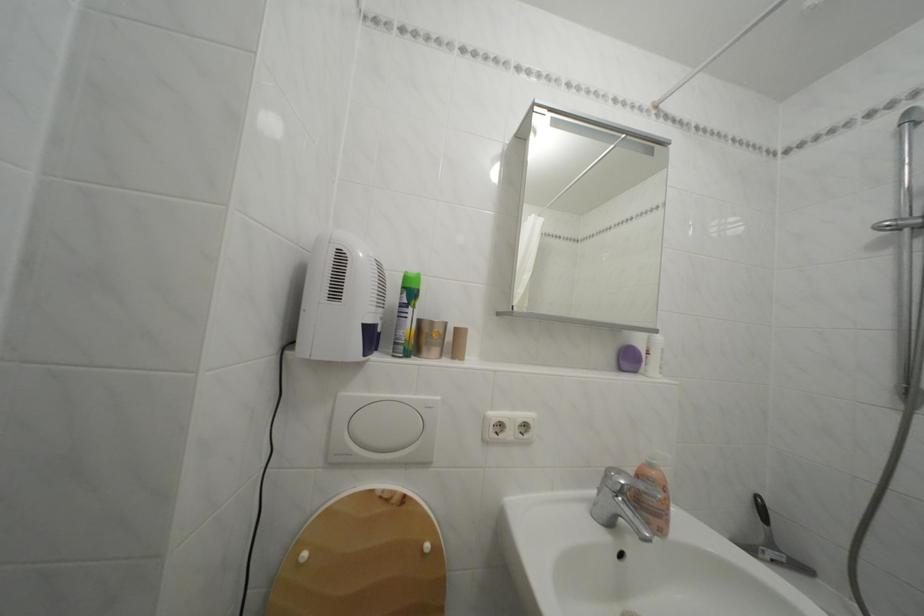
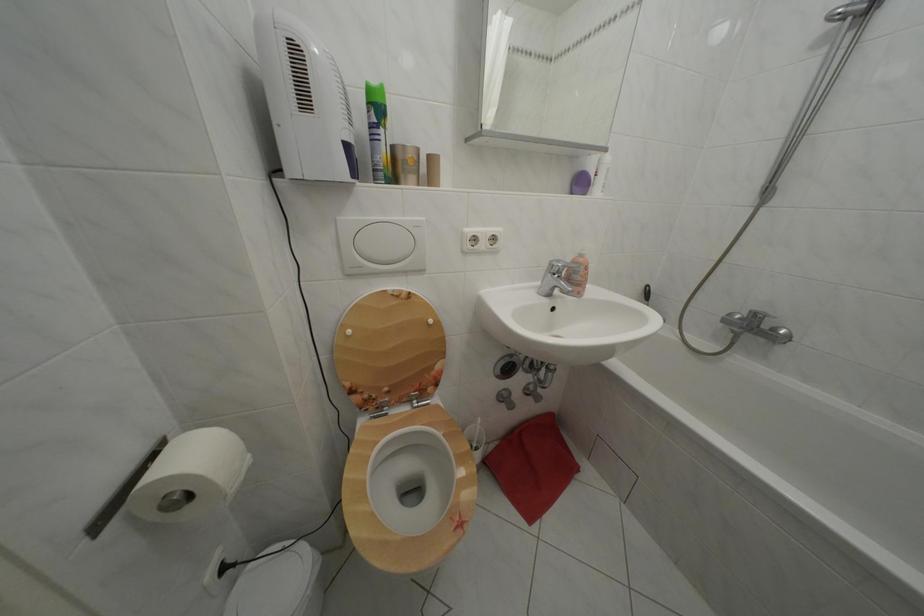
In the second image, find the point that corresponds to point (411, 294) in the first image.

(378, 110)